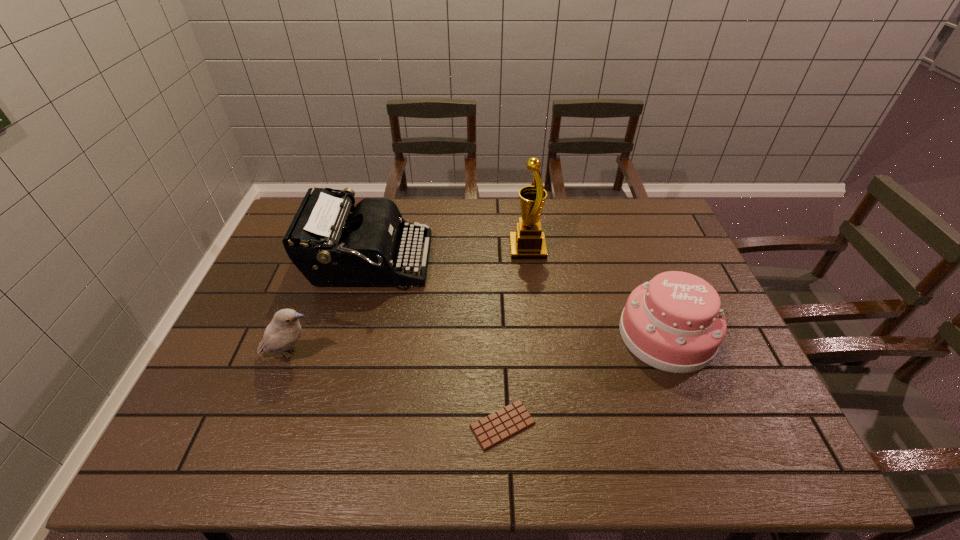
Locate an element on the screen. This screenshot has height=540, width=960. free space located 0.100m at the beak of the bird is located at coordinates (360, 356).

Find the location of `free space located 0.380m on the back of the birthday cake`. free space located 0.380m on the back of the birthday cake is located at coordinates click(x=623, y=221).

This screenshot has width=960, height=540. I want to click on vacant region located 0.360m on the left of the nearest object, so click(x=311, y=425).

The image size is (960, 540). Find the location of `award present at the far edge`. award present at the far edge is located at coordinates (528, 242).

Find the location of a particular element. typewriter that is positioned at the far edge is located at coordinates (330, 246).

You are a GUI agent. You are given a task and a screenshot of the screen. Output one action in this format:
    pyautogui.click(x=<x>, y=<y>)
    Task: Click on the object located in the near edge section of the desktop
    This screenshot has width=960, height=540.
    Given the screenshot: What is the action you would take?
    (491, 430)

What are the coordinates of `typewriter that is positioned at the left edge` in the screenshot? It's located at (330, 246).

Where is `bird located in the left edge section of the desktop`? bird located in the left edge section of the desktop is located at coordinates (283, 332).

Locate an element on the screen. The height and width of the screenshot is (540, 960). object that is at the right edge is located at coordinates (674, 323).

The width and height of the screenshot is (960, 540). In order to click on object that is at the far left corner in this screenshot , I will do `click(330, 246)`.